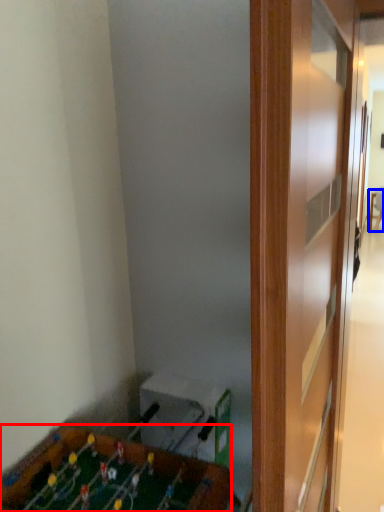
Question: Which point is further to the camera, furniture (highlighted by a red box) or table (highlighted by a blue box)?

Choices:
 (A) furniture
 (B) table

Answer: (B)